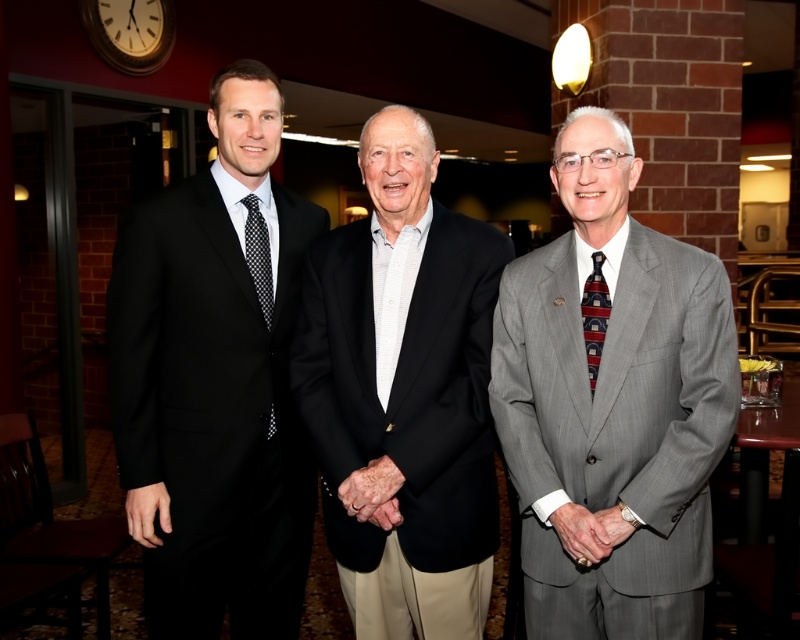
Can you confirm if matte black suit at left is wider than smooth gray suit at center?

Yes.

Between matte black suit at left and smooth gray suit at center, which one appears on the right side from the viewer's perspective?

smooth gray suit at center

Does point (192, 180) lie in front of point (620, 529)?

That is False.

Locate an element on the screen. The height and width of the screenshot is (640, 800). matte black suit at left is located at coordinates (216, 380).

Who is more forward, (600, 544) or (608, 516)?

Point (600, 544) is more forward.

Can you confirm if smooth gray suit at center is smaller than silver metallic watch at center?

Actually, smooth gray suit at center might be larger than silver metallic watch at center.

The height and width of the screenshot is (640, 800). What do you see at coordinates (588, 531) in the screenshot?
I see `smooth gray suit at center` at bounding box center [588, 531].

At what (x,y) coordinates should I click in order to perform the action: click on smooth gray suit at center. Please return your answer as a coordinate pair (x, y). The image size is (800, 640). Looking at the image, I should click on (588, 531).

Measure the distance between gray pinstripe suit at right and smooth skin hand at center.

They are 21.37 inches apart.

Is point (660, 525) more distant than point (380, 525)?

No, it is in front of (380, 525).

You are a GUI agent. You are given a task and a screenshot of the screen. Output one action in this format:
    pyautogui.click(x=<x>, y=<y>)
    Task: Click on the gray pinstripe suit at right
    
    Given the screenshot: What is the action you would take?
    [613, 401]